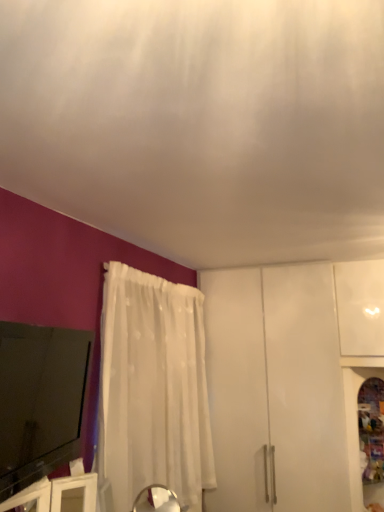
Question: Is white sheer curtain at lower center shorter than white glossy cabinet at lower right?

Choices:
 (A) no
 (B) yes

Answer: (B)

Question: Could white glossy cabinet at lower right be considered to be inside white sheer curtain at lower center?

Choices:
 (A) no
 (B) yes

Answer: (A)

Question: Can you confirm if white sheer curtain at lower center is taller than white glossy cabinet at lower right?

Choices:
 (A) yes
 (B) no

Answer: (B)

Question: Does white sheer curtain at lower center appear on the right side of white glossy cabinet at lower right?

Choices:
 (A) no
 (B) yes

Answer: (A)

Question: From a real-world perspective, does white sheer curtain at lower center sit lower than white glossy cabinet at lower right?

Choices:
 (A) yes
 (B) no

Answer: (B)

Question: Is white sheer curtain at lower center not within white glossy cabinet at lower right?

Choices:
 (A) no
 (B) yes

Answer: (B)

Question: Is the depth of white sheer curtain at left less than that of white sheer curtain at lower center?

Choices:
 (A) no
 (B) yes

Answer: (A)

Question: Is white sheer curtain at left not within white sheer curtain at lower center?

Choices:
 (A) yes
 (B) no

Answer: (A)

Question: Does white sheer curtain at left have a larger size compared to white sheer curtain at lower center?

Choices:
 (A) no
 (B) yes

Answer: (A)

Question: Can you confirm if white sheer curtain at left is wider than white sheer curtain at lower center?

Choices:
 (A) no
 (B) yes

Answer: (A)

Question: Does white sheer curtain at left have a smaller size compared to white sheer curtain at lower center?

Choices:
 (A) yes
 (B) no

Answer: (A)

Question: From a real-world perspective, is white sheer curtain at left located beneath white sheer curtain at lower center?

Choices:
 (A) no
 (B) yes

Answer: (B)

Question: From the image's perspective, does white sheer curtain at lower center appear higher than white sheer curtain at left?

Choices:
 (A) no
 (B) yes

Answer: (B)